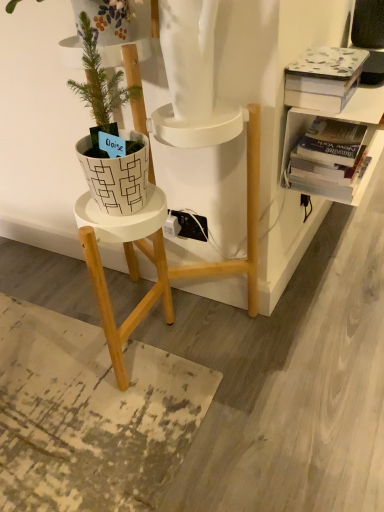
Question: Is white textured book at upper right, the first book when ordered from top to bottom, at the back of hardcover book at upper right, placed as the second book when sorted from top to bottom?

Choices:
 (A) yes
 (B) no

Answer: (B)

Question: Does hardcover book at upper right, placed as the second book when sorted from top to bottom, turn towards white textured book at upper right, the first book when ordered from top to bottom?

Choices:
 (A) yes
 (B) no

Answer: (B)

Question: Are hardcover book at upper right, placed as the first book when sorted from bottom to top, and white textured book at upper right, the 2th book from the bottom, beside each other?

Choices:
 (A) yes
 (B) no

Answer: (B)

Question: Considering the relative sizes of hardcover book at upper right, placed as the second book when sorted from top to bottom, and white textured book at upper right, the first book when ordered from top to bottom, in the image provided, is hardcover book at upper right, placed as the second book when sorted from top to bottom, wider than white textured book at upper right, the first book when ordered from top to bottom,?

Choices:
 (A) yes
 (B) no

Answer: (A)

Question: Is hardcover book at upper right, placed as the first book when sorted from bottom to top, at the left side of white textured book at upper right, the first book when ordered from top to bottom?

Choices:
 (A) yes
 (B) no

Answer: (B)

Question: From the image's perspective, is hardcover book at upper right, placed as the first book when sorted from bottom to top, above white textured book at upper right, the first book when ordered from top to bottom?

Choices:
 (A) yes
 (B) no

Answer: (B)

Question: Is the depth of white matte pot at left less than that of hardcover book at upper right, placed as the second book when sorted from top to bottom?

Choices:
 (A) no
 (B) yes

Answer: (B)

Question: From a real-world perspective, is white matte pot at left located higher than hardcover book at upper right, placed as the first book when sorted from bottom to top?

Choices:
 (A) no
 (B) yes

Answer: (B)

Question: Is there a large distance between white matte pot at left and hardcover book at upper right, placed as the second book when sorted from top to bottom?

Choices:
 (A) no
 (B) yes

Answer: (A)

Question: Is white matte pot at left wider than hardcover book at upper right, placed as the first book when sorted from bottom to top?

Choices:
 (A) no
 (B) yes

Answer: (A)

Question: Is white matte pot at left not inside hardcover book at upper right, placed as the second book when sorted from top to bottom?

Choices:
 (A) no
 (B) yes

Answer: (B)

Question: Does white matte pot at left have a lesser height compared to hardcover book at upper right, placed as the first book when sorted from bottom to top?

Choices:
 (A) no
 (B) yes

Answer: (A)

Question: Considering the relative sizes of hardcover book at upper right, placed as the first book when sorted from bottom to top, and white matte pot at left in the image provided, is hardcover book at upper right, placed as the first book when sorted from bottom to top, bigger than white matte pot at left?

Choices:
 (A) yes
 (B) no

Answer: (B)